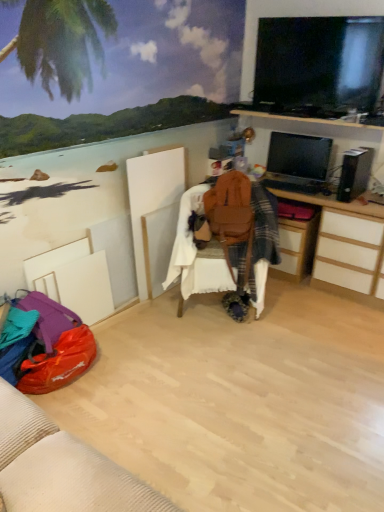
Question: Is brown leather bean bag chair at center facing away from matte black monitor at upper right, which ranks as the 2th television in top-to-bottom order?

Choices:
 (A) no
 (B) yes

Answer: (A)

Question: From a real-world perspective, is brown leather bean bag chair at center physically below matte black monitor at upper right, the 1th television ordered from the bottom?

Choices:
 (A) no
 (B) yes

Answer: (B)

Question: Does brown leather bean bag chair at center have a greater height compared to matte black monitor at upper right, which ranks as the 2th television in top-to-bottom order?

Choices:
 (A) no
 (B) yes

Answer: (B)

Question: Does brown leather bean bag chair at center have a lesser height compared to matte black monitor at upper right, the 1th television ordered from the bottom?

Choices:
 (A) no
 (B) yes

Answer: (A)

Question: Considering the relative positions of brown leather bean bag chair at center and matte black monitor at upper right, which ranks as the 2th television in top-to-bottom order, in the image provided, is brown leather bean bag chair at center to the left of matte black monitor at upper right, which ranks as the 2th television in top-to-bottom order, from the viewer's perspective?

Choices:
 (A) yes
 (B) no

Answer: (A)

Question: Does brown leather bean bag chair at center have a lesser width compared to matte black monitor at upper right, the 1th television ordered from the bottom?

Choices:
 (A) yes
 (B) no

Answer: (B)

Question: Considering the relative sizes of matte black monitor at upper right, which ranks as the 2th television in top-to-bottom order, and wooden drawer at center-right in the image provided, is matte black monitor at upper right, which ranks as the 2th television in top-to-bottom order, smaller than wooden drawer at center-right?

Choices:
 (A) no
 (B) yes

Answer: (B)

Question: Is matte black monitor at upper right, which ranks as the 2th television in top-to-bottom order, in front of wooden drawer at center-right?

Choices:
 (A) yes
 (B) no

Answer: (B)

Question: Is matte black monitor at upper right, the 1th television ordered from the bottom, oriented away from wooden drawer at center-right?

Choices:
 (A) yes
 (B) no

Answer: (B)

Question: Is matte black monitor at upper right, which ranks as the 2th television in top-to-bottom order, outside of wooden drawer at center-right?

Choices:
 (A) no
 (B) yes

Answer: (B)

Question: Could you tell me if matte black monitor at upper right, which ranks as the 2th television in top-to-bottom order, is turned towards wooden drawer at center-right?

Choices:
 (A) yes
 (B) no

Answer: (B)

Question: From a real-world perspective, is matte black monitor at upper right, the 1th television ordered from the bottom, over wooden drawer at center-right?

Choices:
 (A) yes
 (B) no

Answer: (A)

Question: Is brown leather bean bag chair at center to the left of wooden drawer at center-right from the viewer's perspective?

Choices:
 (A) no
 (B) yes

Answer: (B)